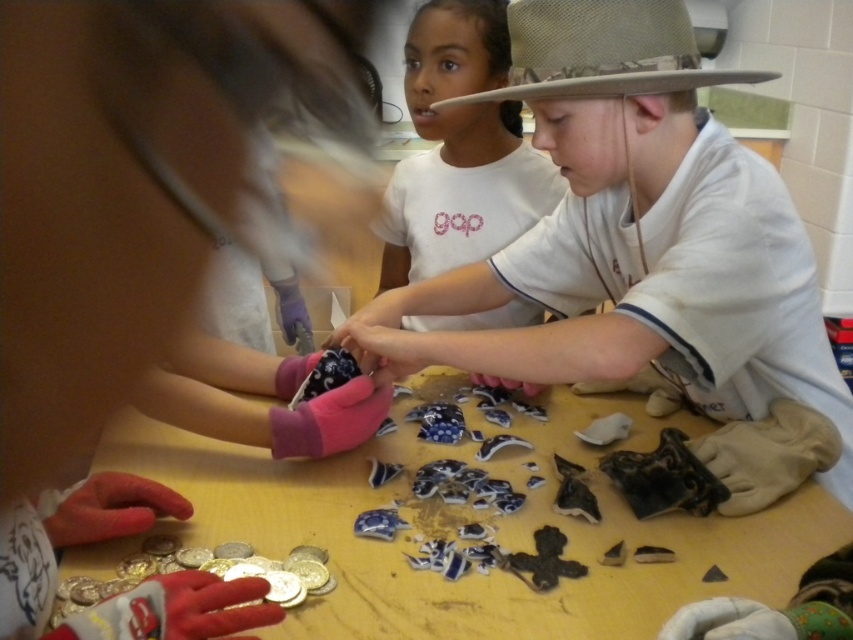
You are an archaeologist working in a lab and need to determine which of the two shirts at the center of the table is wider. You have a matte white shirt at center and a white cotton shirt at center. Which one is wider?

The matte white shirt at center is wider than the white cotton shirt at center according to the description.

You are an archaeologist who needs to reach a point marked at coordinates [480,61] on the table. The camera is positioned directly above the table. If you extend your hand straight down from the camera, will your hand land closer than 1.5 meters to the point?

The distance of point [480,61] from the camera is 1.46 meters, so yes, your hand will land closer than 1.5 meters to the point.

Where is the white cotton shirt at center located in the image?

The white cotton shirt at center is located at point (460, 148).